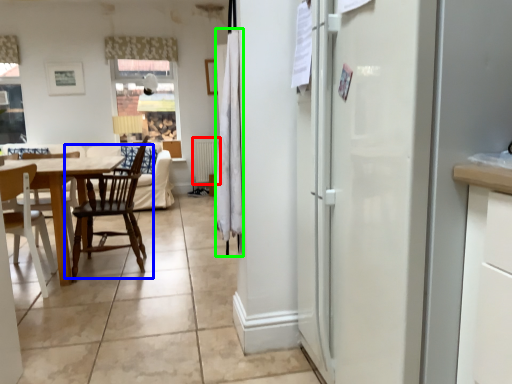
Question: Estimate the real-world distances between objects in this image. Which object is closer to radiator (highlighted by a red box), chair (highlighted by a blue box) or curtain (highlighted by a green box)?

Choices:
 (A) chair
 (B) curtain

Answer: (A)